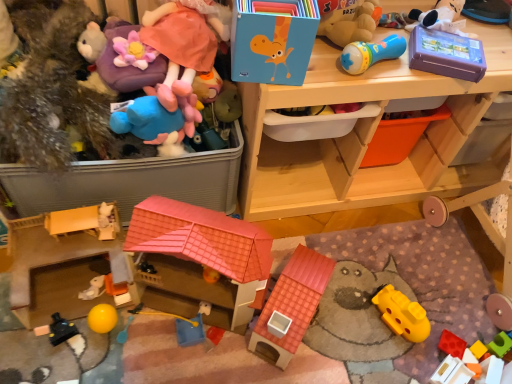
Image resolution: width=512 pixels, height=384 pixels. Find the location of `free space to the right of blue plastic toy at center, the 8th toy viewed from the left`. free space to the right of blue plastic toy at center, the 8th toy viewed from the left is located at coordinates (238, 350).